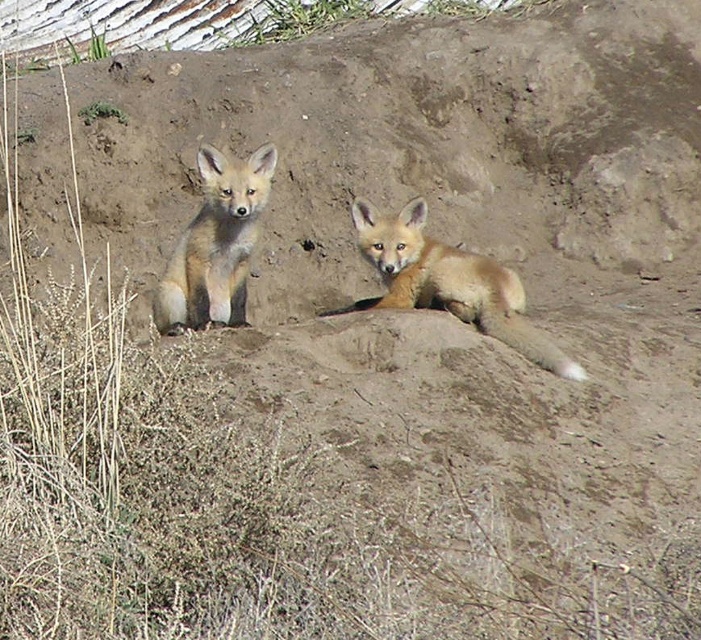
Is point (418, 275) in front of point (204, 314)?

No, (418, 275) is further to viewer.

Image resolution: width=701 pixels, height=640 pixels. What are the coordinates of `golden fur fox at center` in the screenshot? It's located at (449, 282).